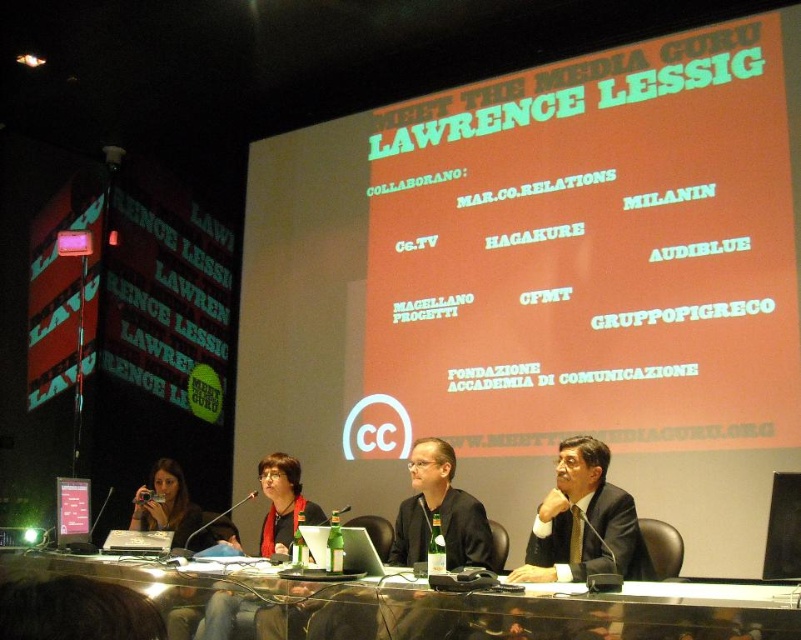
Which is below, transparent glass table at center or silver metallic laptop at center?

transparent glass table at center is below.

Can you confirm if transparent glass table at center is thinner than silver metallic laptop at center?

Incorrect, transparent glass table at center's width is not less than silver metallic laptop at center's.

Measure the distance between point (727, 636) and camera.

They are 2.11 meters apart.

The width and height of the screenshot is (801, 640). Identify the location of transparent glass table at center. (437, 605).

Is point (190, 525) positioned after point (349, 563)?

Yes, point (190, 525) is behind point (349, 563).

Can you confirm if matte black camera at lower left is bigger than silver metallic laptop at center?

Yes, matte black camera at lower left is bigger than silver metallic laptop at center.

Which is behind, point (175, 500) or point (397, 570)?

Positioned behind is point (175, 500).

Locate an element on the screen. matte black camera at lower left is located at coordinates (167, 506).

Between matte black jacket at center and matte black camera at lower left, which one appears on the right side from the viewer's perspective?

matte black jacket at center is more to the right.

Where is `matte black jacket at center`? matte black jacket at center is located at coordinates pos(284,504).

Locate an element on the screen. This screenshot has height=640, width=801. matte black jacket at center is located at coordinates (284, 504).